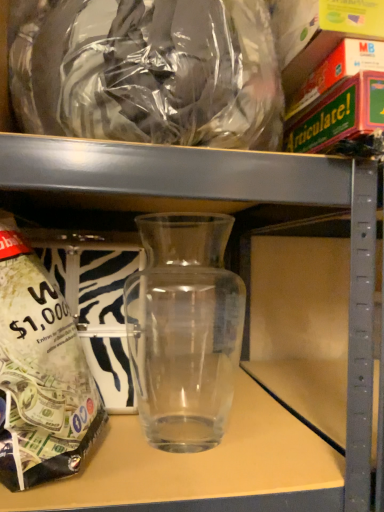
Question: From the image's perspective, relative to transparent plastic bag at upper center, is transparent glass vase at center above or below?

Choices:
 (A) below
 (B) above

Answer: (A)

Question: Is point (221, 352) closer or farther from the camera than point (218, 94)?

Choices:
 (A) farther
 (B) closer

Answer: (A)

Question: Which of these objects is positioned farthest from the transparent glass jar at left?

Choices:
 (A) transparent plastic bag at upper center
 (B) transparent glass vase at center

Answer: (B)

Question: Which is nearer to the transparent glass jar at left?

Choices:
 (A) transparent glass vase at center
 (B) transparent plastic bag at upper center

Answer: (B)